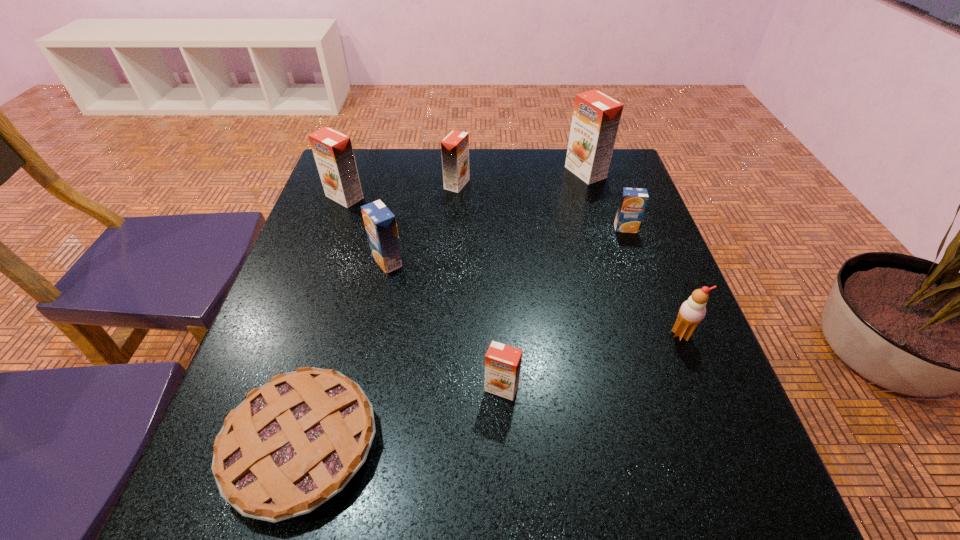
Find the location of a particular element. This screenshot has height=540, width=960. vacant space located on the left of the smallest orange orange juice is located at coordinates (339, 388).

At what (x,y) coordinates should I click in order to perform the action: click on free space located 0.170m on the right of the shortest object. Please return your answer as a coordinate pair (x, y). The image size is (960, 540). Looking at the image, I should click on (483, 444).

I want to click on object located in the near edge section of the desktop, so click(x=293, y=443).

The image size is (960, 540). What are the coordinates of `orange juice situated at the left edge` in the screenshot? It's located at (332, 150).

Find the location of a particular element. The width and height of the screenshot is (960, 540). pie that is at the left edge is located at coordinates (293, 443).

Locate an element on the screen. The image size is (960, 540). icecream present at the right edge is located at coordinates (692, 311).

Where is `object that is positioned at the far left corner`? Image resolution: width=960 pixels, height=540 pixels. object that is positioned at the far left corner is located at coordinates (332, 150).

This screenshot has width=960, height=540. I want to click on object at the near left corner, so click(293, 443).

In order to click on object that is at the far right corner in this screenshot , I will do `click(596, 116)`.

In the image, there is a desktop. Where is `vacant space at the far edge`? The height and width of the screenshot is (540, 960). vacant space at the far edge is located at coordinates (516, 148).